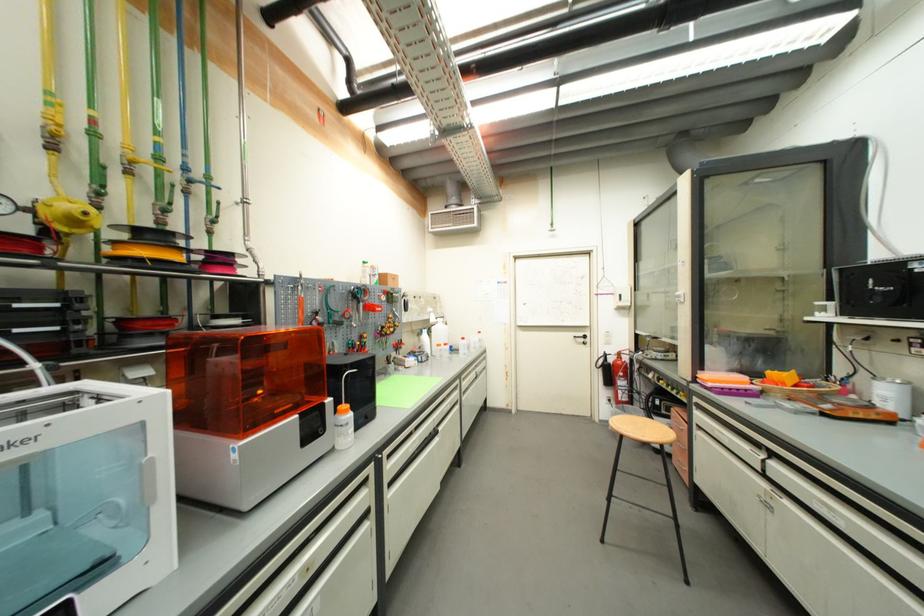
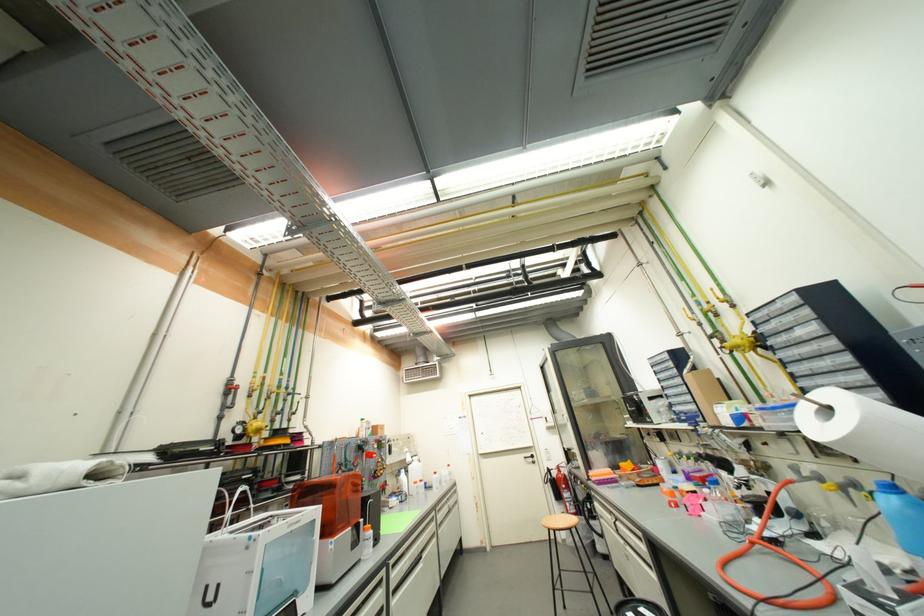
The point at (392, 483) is marked in the first image. Where is the corresponding point in the second image?

(396, 590)